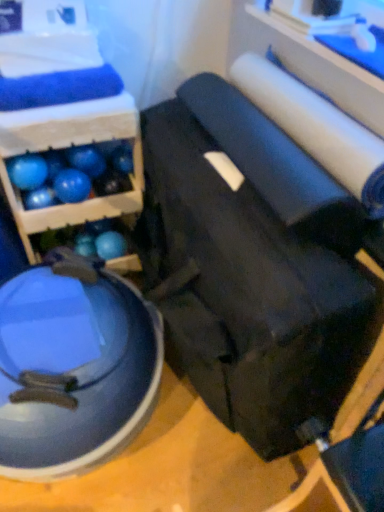
Question: From a real-world perspective, is blue rubber ball at upper left, arranged as the 5th ball when viewed from the right, physically located above or below blue rubber ball at lower left, the 2th ball when ordered from left to right?

Choices:
 (A) above
 (B) below

Answer: (A)

Question: Would you say blue rubber ball at upper left, arranged as the 5th ball when viewed from the right, is inside or outside blue rubber ball at lower left, the 2th ball when ordered from left to right?

Choices:
 (A) outside
 (B) inside

Answer: (A)

Question: Based on their relative distances, which object is farther from the blue rubber ball at center-left, the fourth ball from the left?

Choices:
 (A) blue rubber ball at upper left, arranged as the 5th ball when viewed from the right
 (B) black leather swivel chair at center, positioned as the first swivel chair in right-to-left order
 (C) glossy blue exercise ball at lower left, which appears as the 1th swivel chair when viewed from the left
 (D) blue matte wood shelf at upper left
 (E) blue rubber ball at upper left, the third ball when ordered from left to right

Answer: (B)

Question: Which object is the farthest from the glossy blue exercise ball at lower left, which appears as the 1th swivel chair when viewed from the left?

Choices:
 (A) blue rubber ball at center, which is the 5th ball in left-to-right order
 (B) blue rubber ball at upper left, the first ball when ordered from left to right
 (C) blue rubber ball at lower left, placed as the 4th ball when sorted from right to left
 (D) black leather swivel chair at center, positioned as the first swivel chair in right-to-left order
 (E) blue rubber ball at upper left, the third ball when ordered from left to right

Answer: (A)